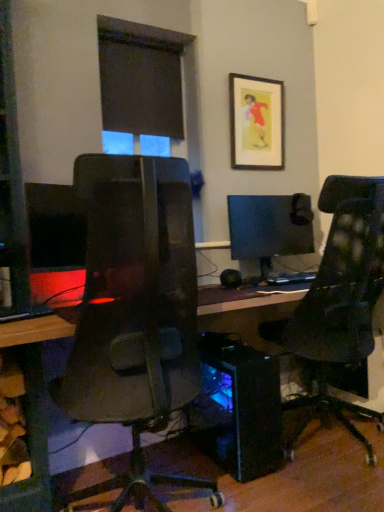
Question: From a real-world perspective, is transparent blue computer tower at center positioned above or below wooden framed picture at upper center?

Choices:
 (A) below
 (B) above

Answer: (A)

Question: Is transparent blue computer tower at center in front of or behind wooden framed picture at upper center in the image?

Choices:
 (A) behind
 (B) front

Answer: (B)

Question: Which object is positioned farthest from the transparent blue computer tower at center?

Choices:
 (A) wooden framed picture at upper center
 (B) matte black monitor at left, the 2th computer monitor positioned from the right
 (C) matte black monitor at center, the 1th computer monitor positioned from the right

Answer: (A)

Question: Which object is positioned closest to the matte black monitor at center, the 2th computer monitor viewed from the left?

Choices:
 (A) matte black monitor at left, the 2th computer monitor positioned from the right
 (B) transparent blue computer tower at center
 (C) wooden framed picture at upper center

Answer: (C)